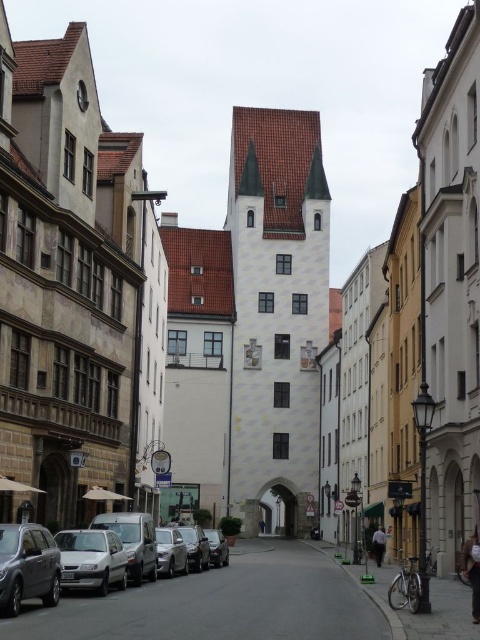
Between shiny silver sedan at center and dark blue jeans at center, which one appears on the right side from the viewer's perspective?

Positioned to the right is dark blue jeans at center.

Is shiny silver sedan at center in front of dark blue jeans at center?

Yes, it is in front of dark blue jeans at center.

I want to click on shiny silver sedan at center, so click(x=216, y=547).

This screenshot has width=480, height=640. Describe the element at coordinates (472, 570) in the screenshot. I see `light brown leather jacket at lower right` at that location.

In the scene shown: Who is lower down, light brown leather jacket at lower right or shiny silver sedan at center?

shiny silver sedan at center is lower down.

The width and height of the screenshot is (480, 640). What do you see at coordinates (472, 570) in the screenshot?
I see `light brown leather jacket at lower right` at bounding box center [472, 570].

Locate an element on the screen. This screenshot has width=480, height=640. light brown leather jacket at lower right is located at coordinates (472, 570).

Between silver metallic sedan at lower left and dark blue jeans at center, which one has less height?

Standing shorter between the two is silver metallic sedan at lower left.

Identify the location of silver metallic sedan at lower left. Image resolution: width=480 pixels, height=640 pixels. (92, 560).